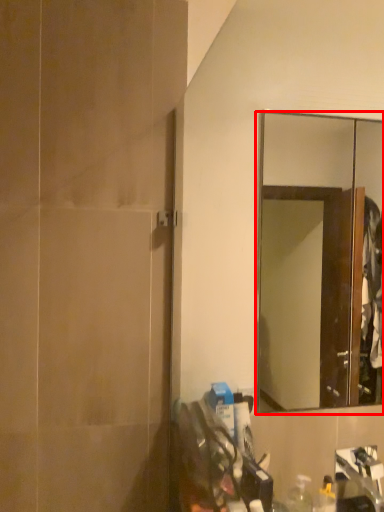
Question: Considering the relative positions of mirror (annotated by the red box) and screen door in the image provided, where is mirror (annotated by the red box) located with respect to the staircase?

Choices:
 (A) left
 (B) right

Answer: (B)